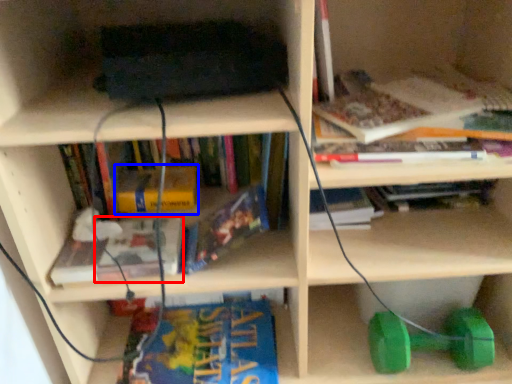
Question: Which point is closer to the camera, book (highlighted by a red box) or book (highlighted by a blue box)?

Choices:
 (A) book
 (B) book

Answer: (A)